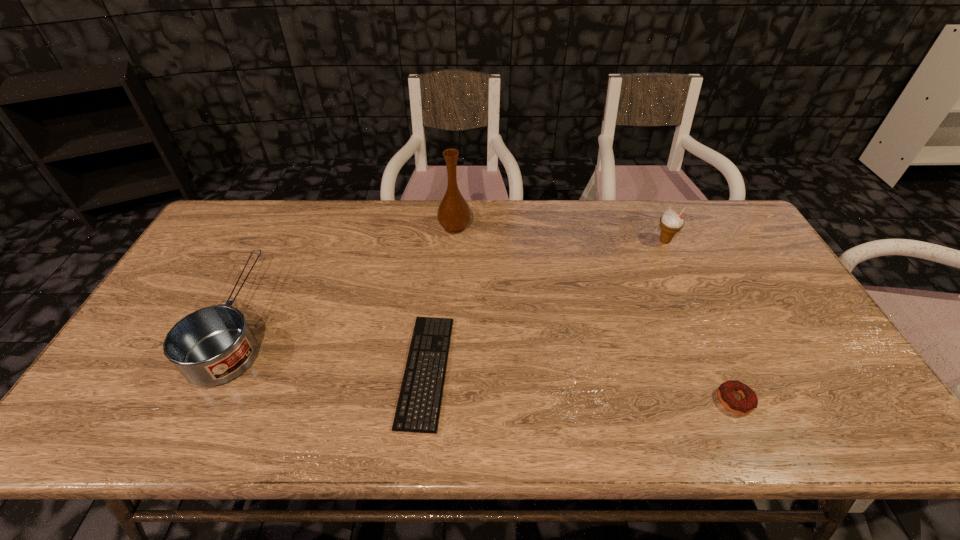
Locate an element on the screen. This screenshot has height=540, width=960. vacant space situated with the handle extending from one side of the leftmost object is located at coordinates (296, 210).

Locate an element on the screen. This screenshot has width=960, height=540. free space located on the right of the doughnut is located at coordinates (842, 400).

Locate an element on the screen. Image resolution: width=960 pixels, height=540 pixels. vacant area located 0.120m on the back of the shortest object is located at coordinates (434, 287).

Identify the location of vase that is at the far edge. The height and width of the screenshot is (540, 960). (453, 214).

The height and width of the screenshot is (540, 960). I want to click on icecream present at the far edge, so click(670, 223).

Find the location of a particular element. doughnut that is at the near edge is located at coordinates (749, 402).

The width and height of the screenshot is (960, 540). What are the coordinates of `computer keyboard that is at the near edge` in the screenshot? It's located at (418, 408).

Where is `object that is at the left edge`? This screenshot has width=960, height=540. object that is at the left edge is located at coordinates coord(213,345).

I want to click on vacant space at the far edge, so click(646, 242).

This screenshot has height=540, width=960. In order to click on free space at the near edge of the desktop in this screenshot , I will do `click(794, 420)`.